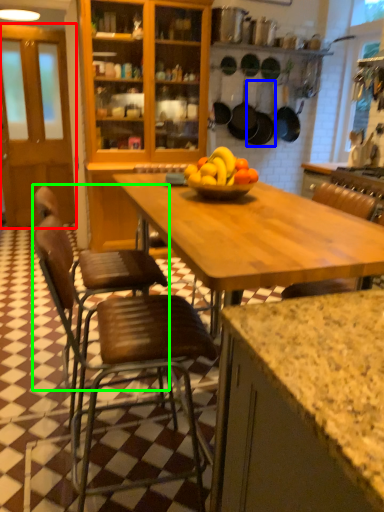
Question: Considering the real-world distances, which object is farthest from glass door (highlighted by a red box)? frying pan (highlighted by a blue box) or chair (highlighted by a green box)?

Choices:
 (A) frying pan
 (B) chair

Answer: (B)